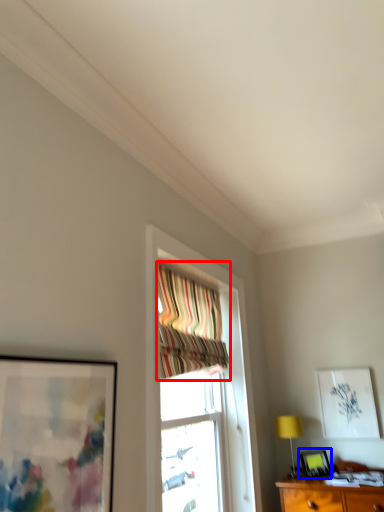
Question: Among these objects, which one is farthest to the camera, curtain (highlighted by a red box) or picture frame (highlighted by a blue box)?

Choices:
 (A) curtain
 (B) picture frame

Answer: (B)